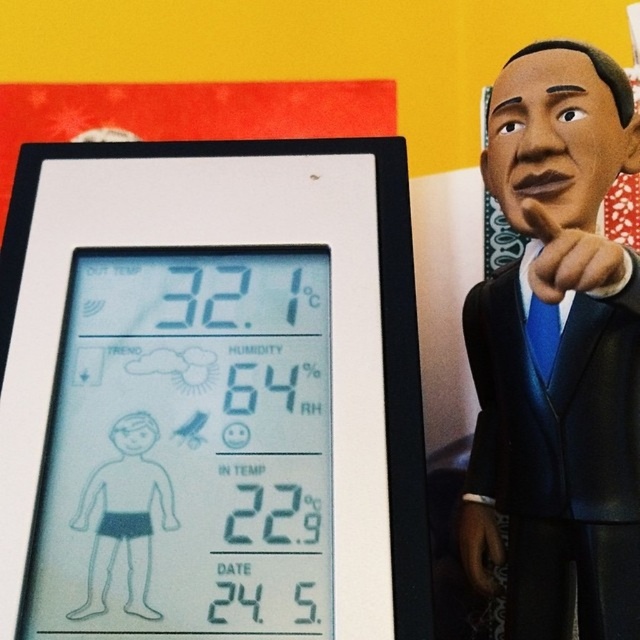
Question: Does transparent plastic thermometer at center appear on the left side of white matte figure at center?

Choices:
 (A) no
 (B) yes

Answer: (A)

Question: Which object is closer to the camera taking this photo?

Choices:
 (A) black glossy figurine at right
 (B) transparent plastic thermometer at center

Answer: (A)

Question: Which of the following is the closest to the observer?

Choices:
 (A) transparent plastic thermometer at center
 (B) white matte figure at center
 (C) black glossy figurine at right

Answer: (C)

Question: Is transparent plastic thermometer at center below black glossy figurine at right?

Choices:
 (A) no
 (B) yes

Answer: (B)

Question: Does transparent plastic thermometer at center appear over black glossy figurine at right?

Choices:
 (A) yes
 (B) no

Answer: (B)

Question: Estimate the real-world distances between objects in this image. Which object is farther from the white matte figure at center?

Choices:
 (A) transparent plastic thermometer at center
 (B) black glossy figurine at right

Answer: (B)